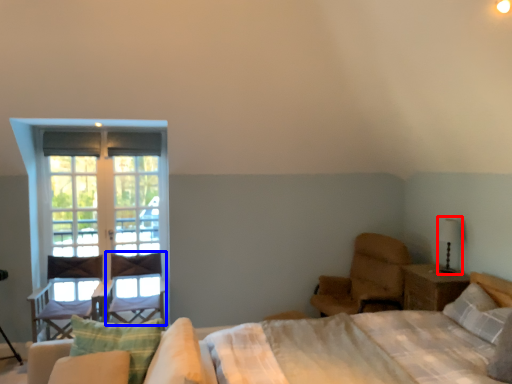
Question: Among these objects, which one is farthest to the camera, table lamp (highlighted by a red box) or swivel chair (highlighted by a blue box)?

Choices:
 (A) table lamp
 (B) swivel chair

Answer: (B)